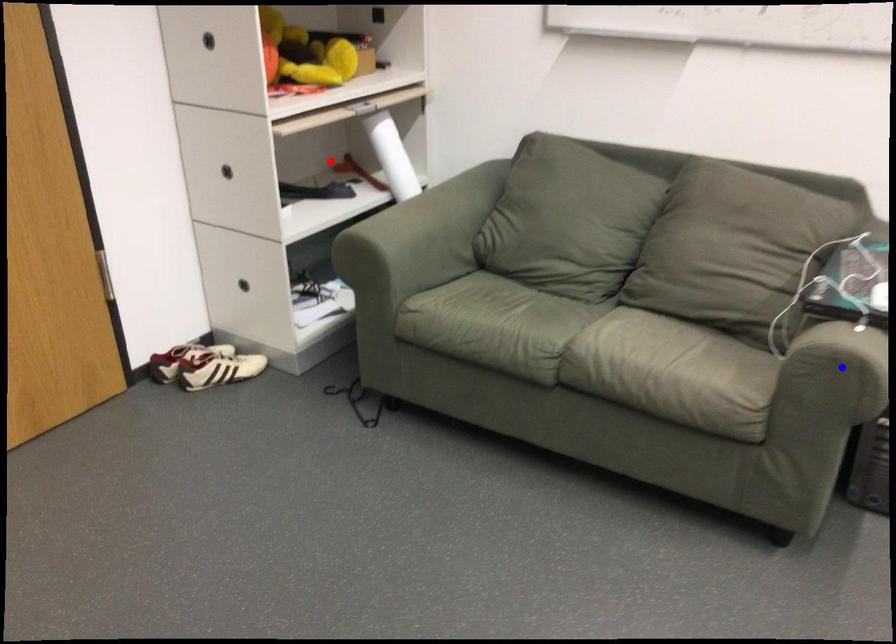
Question: In the image, two points are highlighted. Which point is nearer to the camera? Reply with the corresponding letter.

Choices:
 (A) blue point
 (B) red point

Answer: (A)